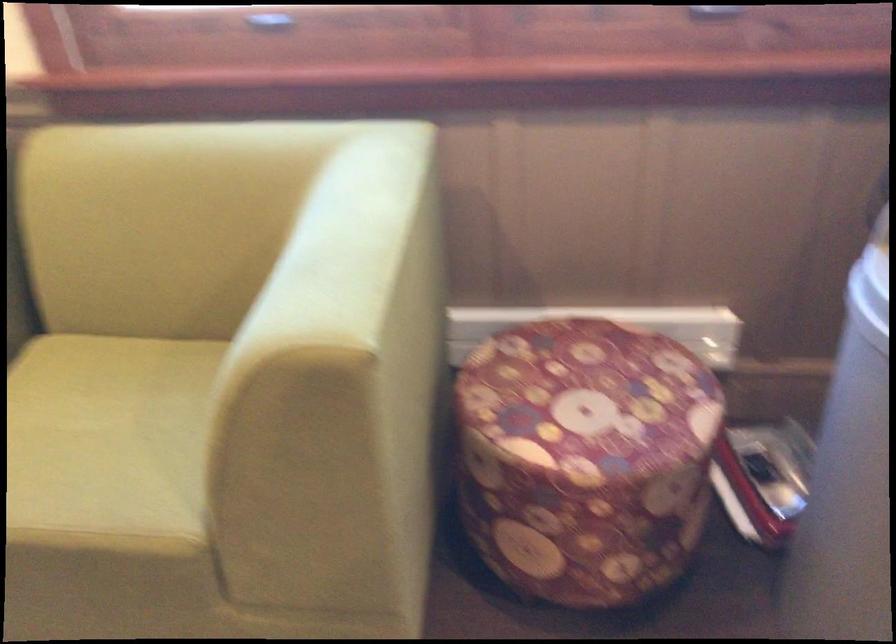
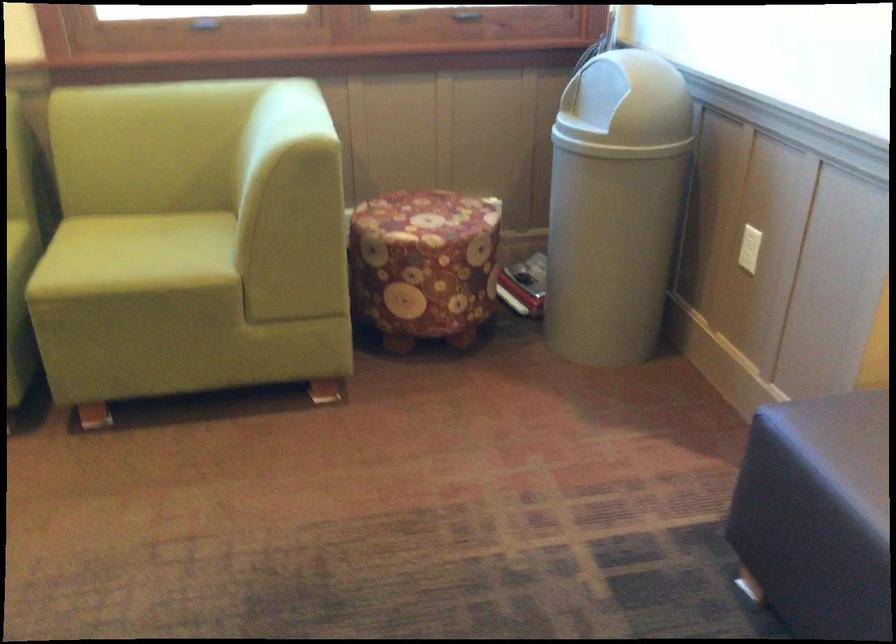
In the second image, find the point that corresponds to point (108, 431) in the first image.

(142, 252)